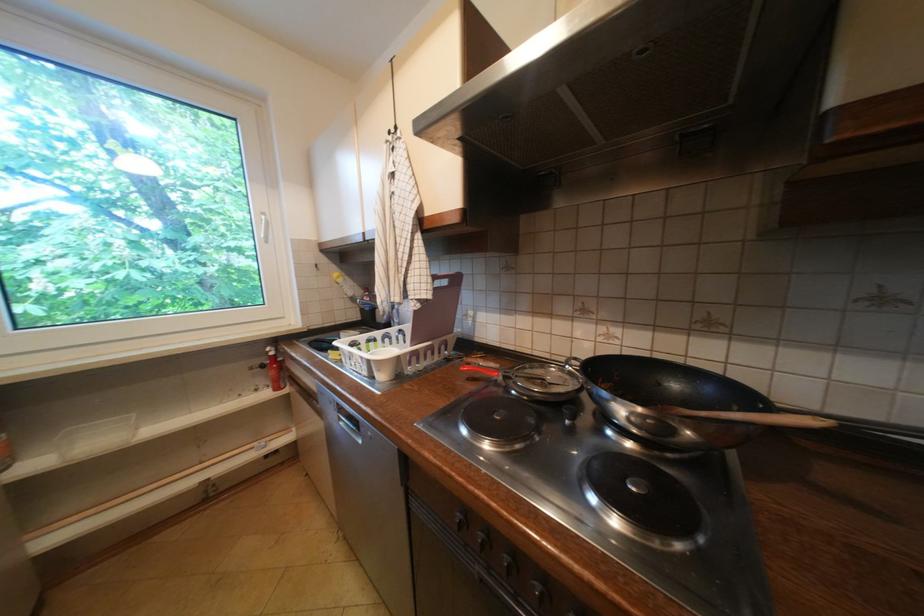
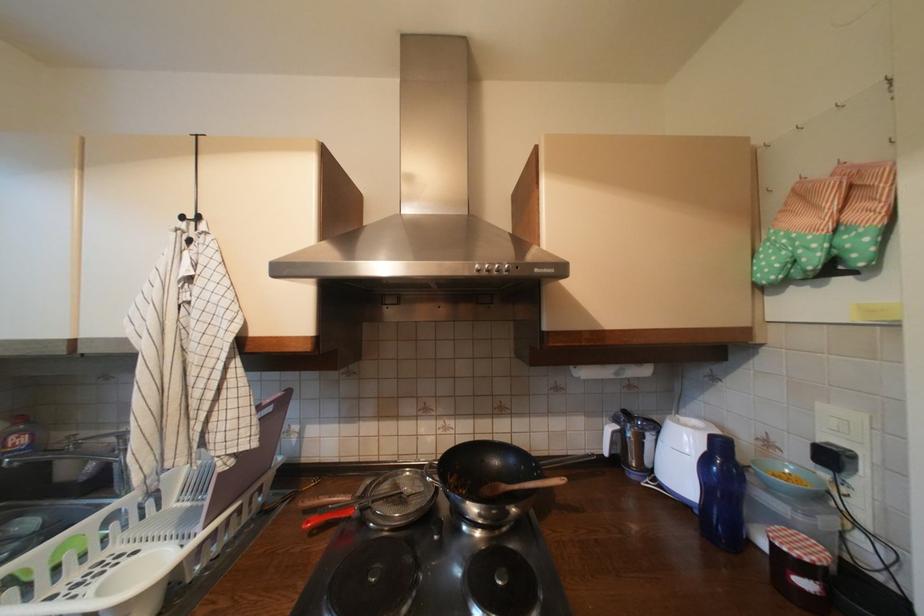
The point at (395, 142) is marked in the first image. Where is the corresponding point in the second image?

(187, 230)